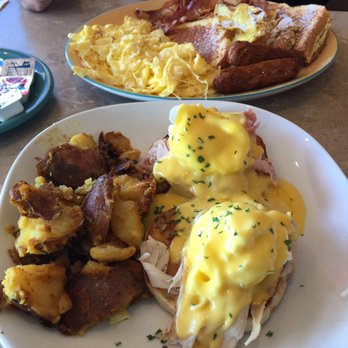
Identify the location of plate. (318, 163), (308, 72), (44, 79).